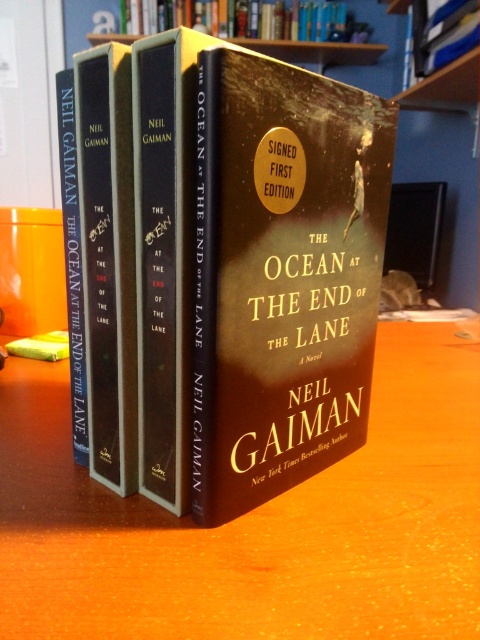
Between brown wooden table at center and matte hardcover book at center, which one appears on the right side from the viewer's perspective?

From the viewer's perspective, matte hardcover book at center appears more on the right side.

Which is above, brown wooden table at center or matte hardcover book at center?

matte hardcover book at center is higher up.

Does point (59, 470) lie in front of point (337, 88)?

No, (59, 470) is further to viewer.

I want to click on brown wooden table at center, so click(x=256, y=524).

Is point (309, 196) positioned after point (300, 24)?

That is False.

Who is more forward, (331, 240) or (137, 8)?

Point (331, 240) is in front.

Locate an element on the screen. matte hardcover book at center is located at coordinates (283, 275).

Between brown wooden table at center and hardcover book at upper center, which one has more height?

With more height is hardcover book at upper center.

Is brown wooden table at center smaller than hardcover book at upper center?

No.

Does point (247, 536) come in front of point (208, 26)?

That is True.

Locate an element on the screen. brown wooden table at center is located at coordinates (256, 524).